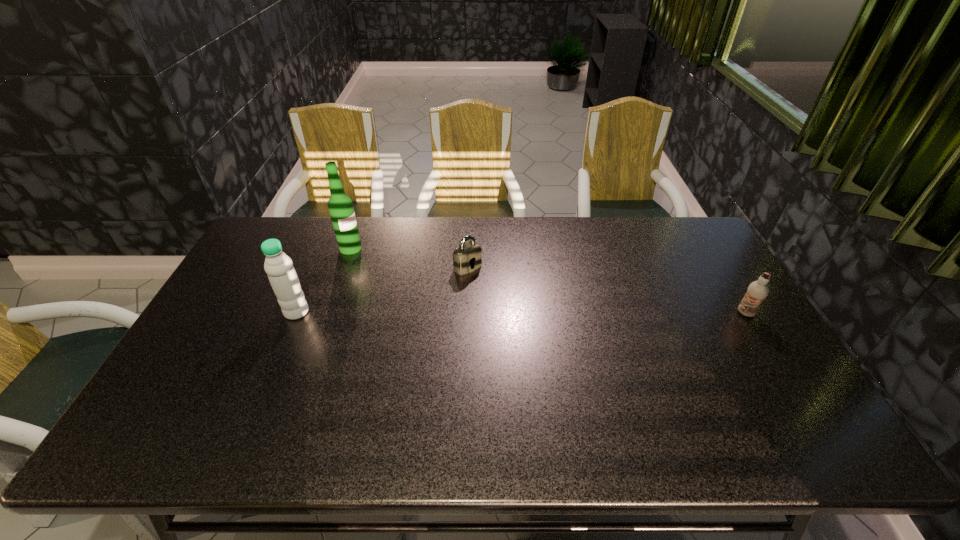
Identify the location of free region located on the label of the third object from right to left. (430, 296).

This screenshot has height=540, width=960. I want to click on blank space located 0.080m on the label of the third object from right to left, so click(x=373, y=262).

This screenshot has height=540, width=960. What are the coordinates of `free space located 0.220m on the label of the third object from right to left` in the screenshot? It's located at (402, 280).

The image size is (960, 540). Find the location of `blank space located at the front of the third nearest object near the keyhole`. blank space located at the front of the third nearest object near the keyhole is located at coordinates (549, 336).

The width and height of the screenshot is (960, 540). Identify the location of vacant area situated 0.180m at the front of the third nearest object near the keyhole. (514, 306).

Locate an element on the screen. The width and height of the screenshot is (960, 540). blank space located at the front of the third nearest object near the keyhole is located at coordinates (539, 327).

The height and width of the screenshot is (540, 960). What are the coordinates of `object positioned at the far edge` in the screenshot? It's located at (340, 206).

Identify the location of object that is at the right edge. The width and height of the screenshot is (960, 540). (x=757, y=291).

Where is `vacant space at the far edge of the desktop`? This screenshot has height=540, width=960. vacant space at the far edge of the desktop is located at coordinates (328, 218).

Where is `vacant space at the near edge of the desktop`? vacant space at the near edge of the desktop is located at coordinates (538, 403).